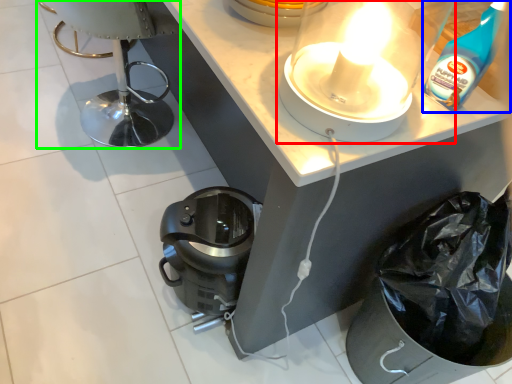
Question: Based on their relative distances, which object is farther from kitchen appliance (highlighted by a red box)? Choose from cleaning product (highlighted by a blue box) and swivel chair (highlighted by a green box).

Choices:
 (A) cleaning product
 (B) swivel chair

Answer: (B)